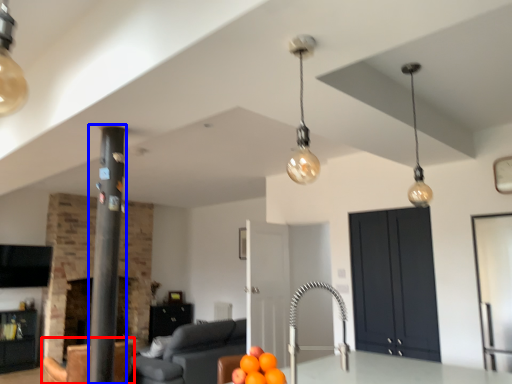
Question: Which object is closer to the camera taking this photo, armchair (highlighted by a red box) or pillar (highlighted by a blue box)?

Choices:
 (A) armchair
 (B) pillar

Answer: (B)